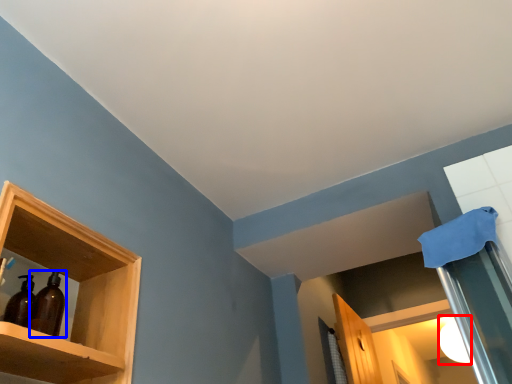
Question: Which point is closer to the camera, lighting (highlighted by a red box) or bottle (highlighted by a blue box)?

Choices:
 (A) lighting
 (B) bottle

Answer: (B)